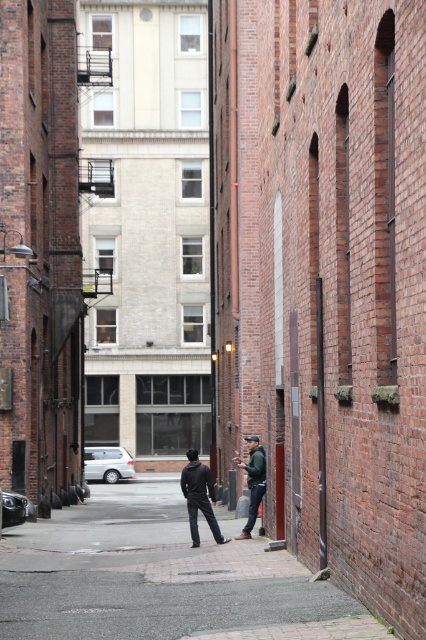
You are a delivery person trying to navigate through the alley. You notice the dark gray asphalt at center and the black matte jacket at center. Which object is higher up from the ground?

The dark gray asphalt at center is taller than the black matte jacket at center, so the dark gray asphalt at center is higher up from the ground.

Based on the photo, you are a delivery drone flying over an urban alleyway. You need to land on the dark gray asphalt at center. What are the coordinates where you should land?

The coordinates for the dark gray asphalt at center are at point (160, 577).